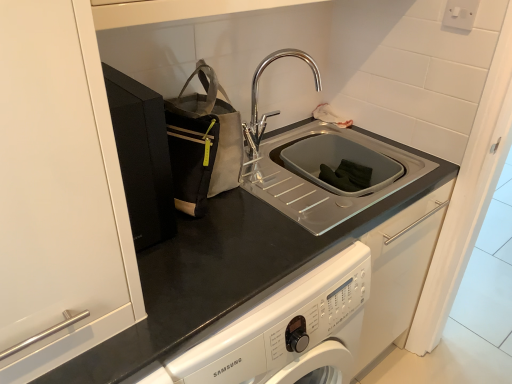
Question: Can you confirm if white plastic electric outlet at upper right is thinner than gray fabric tote at upper left?

Choices:
 (A) yes
 (B) no

Answer: (A)

Question: Would you say white plastic electric outlet at upper right is outside gray fabric tote at upper left?

Choices:
 (A) yes
 (B) no

Answer: (A)

Question: Does white plastic electric outlet at upper right turn towards gray fabric tote at upper left?

Choices:
 (A) no
 (B) yes

Answer: (A)

Question: Is white plastic electric outlet at upper right facing away from gray fabric tote at upper left?

Choices:
 (A) no
 (B) yes

Answer: (A)

Question: Is white plastic electric outlet at upper right wider than gray fabric tote at upper left?

Choices:
 (A) yes
 (B) no

Answer: (B)

Question: Is white plastic electric outlet at upper right taller than gray fabric tote at upper left?

Choices:
 (A) yes
 (B) no

Answer: (B)

Question: Is gray fabric tote at upper left to the right of white plastic electric outlet at upper right from the viewer's perspective?

Choices:
 (A) yes
 (B) no

Answer: (B)

Question: From the image's perspective, does gray fabric tote at upper left appear higher than white plastic electric outlet at upper right?

Choices:
 (A) no
 (B) yes

Answer: (A)

Question: Does gray fabric tote at upper left have a lesser height compared to white plastic electric outlet at upper right?

Choices:
 (A) no
 (B) yes

Answer: (A)

Question: Is gray fabric tote at upper left far away from white plastic electric outlet at upper right?

Choices:
 (A) no
 (B) yes

Answer: (A)

Question: From a real-world perspective, is gray fabric tote at upper left on top of white plastic electric outlet at upper right?

Choices:
 (A) yes
 (B) no

Answer: (B)

Question: Is gray fabric tote at upper left outside white plastic electric outlet at upper right?

Choices:
 (A) no
 (B) yes

Answer: (B)

Question: From the image's perspective, is chrome metallic faucet at upper center on top of gray fabric tote at upper left?

Choices:
 (A) yes
 (B) no

Answer: (A)